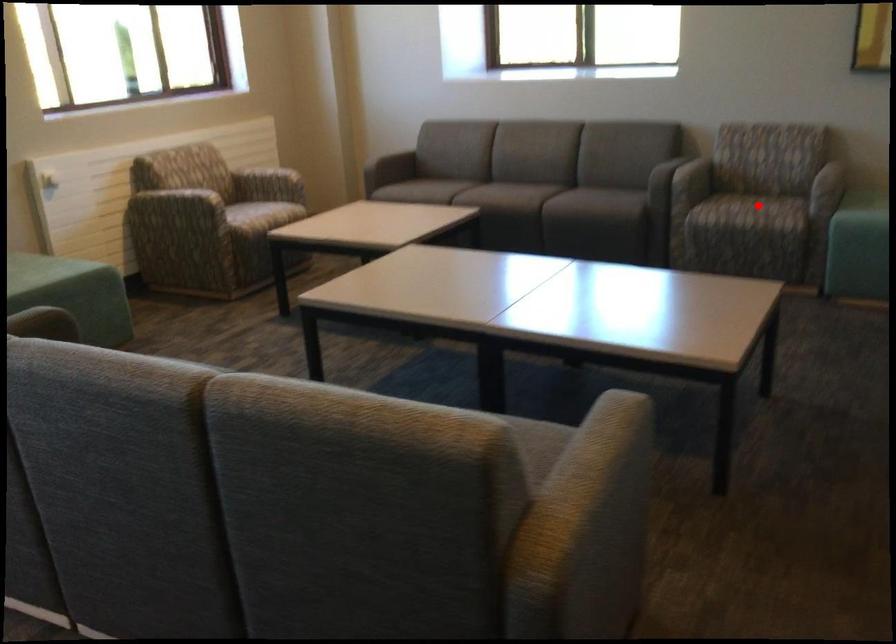
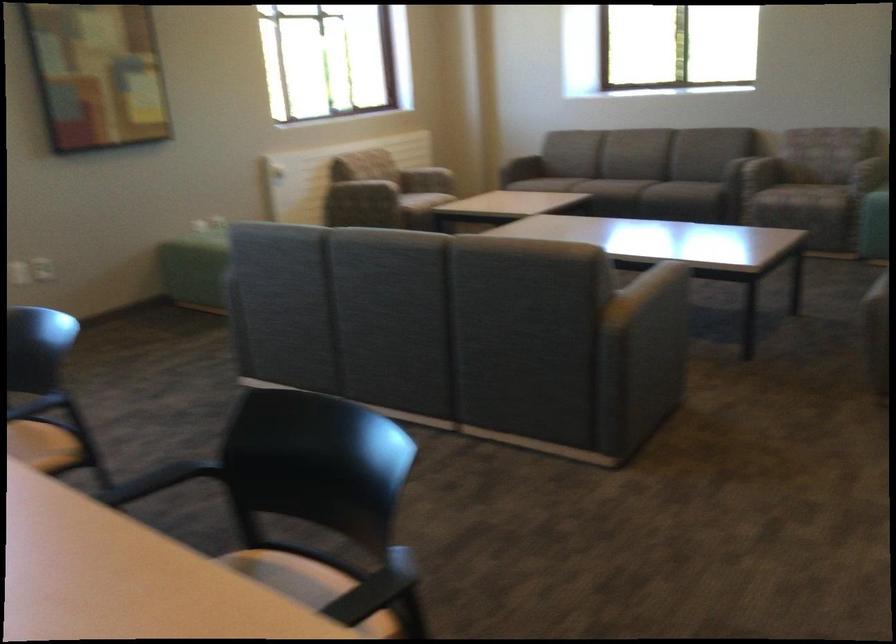
In the second image, find the point that corresponds to the highlighted location in the first image.

(807, 184)